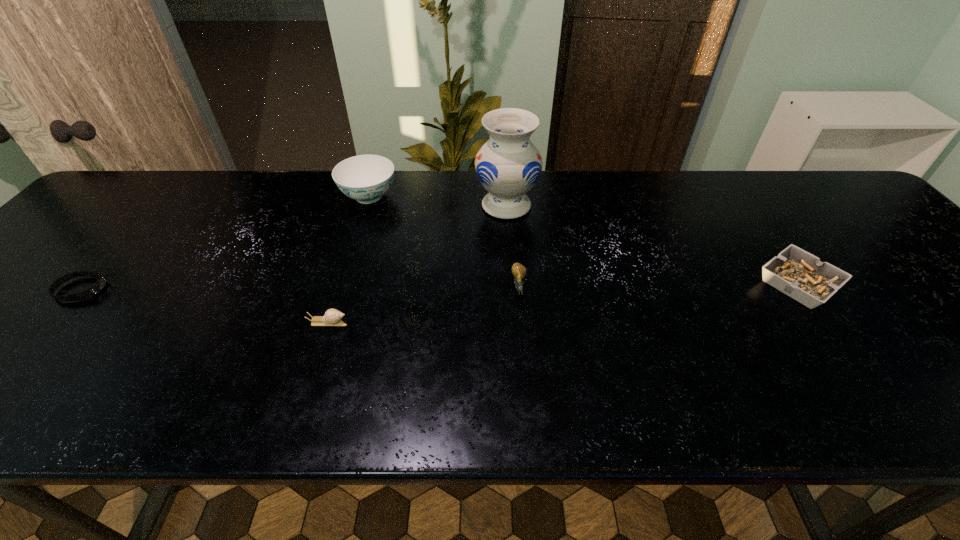
At what (x,y) coordinates should I click in order to perform the action: click on free space between the leftmost object and the nearest object. Please return your answer as a coordinate pair (x, y). Looking at the image, I should click on (204, 306).

At what (x,y) coordinates should I click in order to perform the action: click on free space between the rightmost object and the vase. Please return your answer as a coordinate pair (x, y). Image resolution: width=960 pixels, height=540 pixels. Looking at the image, I should click on (652, 245).

Locate which object is the fifth closest to the rightmost object. Please provide its 2D coordinates. Your answer should be formatted as a tuple, i.e. [(x, y)], where the tuple contains the x and y coordinates of a point satisfying the conditions above.

[(97, 287)]

Locate which object ranks fourth in proximity to the ashtray. Please provide its 2D coordinates. Your answer should be formatted as a tuple, i.e. [(x, y)], where the tuple contains the x and y coordinates of a point satisfying the conditions above.

[(332, 317)]

You are a GUI agent. You are given a task and a screenshot of the screen. Output one action in this format:
    pyautogui.click(x=<x>, y=<y>)
    Task: Click on the vacant space that satisfies the following two spatial constraints: 1. on the front side of the tallest object; 2. on the display of the wristband
    
    Given the screenshot: What is the action you would take?
    pyautogui.click(x=513, y=289)

Locate an element on the screen. The image size is (960, 540). free space that satisfies the following two spatial constraints: 1. on the front side of the chinaware; 2. on the left side of the ashtray is located at coordinates (342, 284).

Identify the location of free space that satisfies the following two spatial constraints: 1. on the front-facing side of the farther escargot; 2. on the display of the shortest object. This screenshot has width=960, height=540. (519, 289).